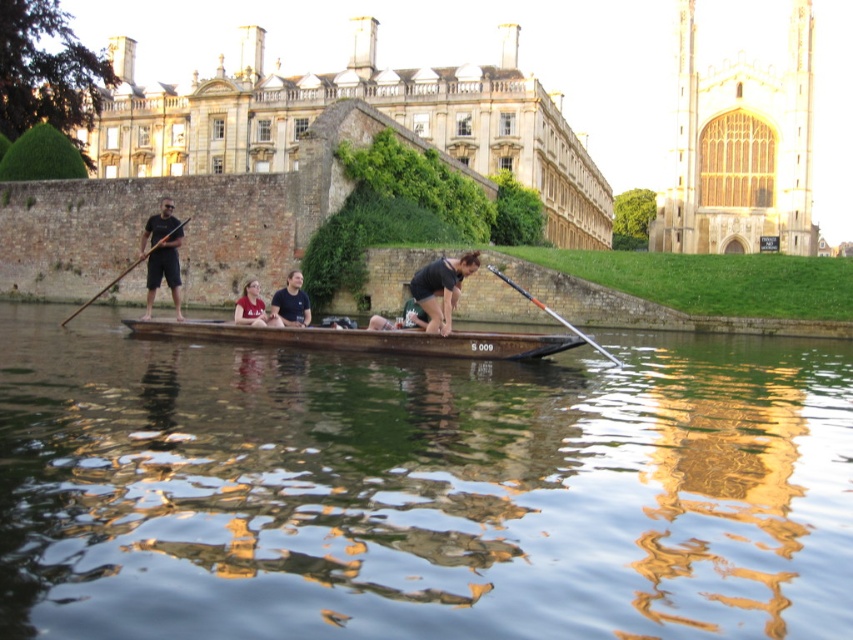
This screenshot has width=853, height=640. What do you see at coordinates (440, 289) in the screenshot?
I see `dark gray fabric shirt at center` at bounding box center [440, 289].

Can you confirm if dark gray fabric shirt at center is wider than wooden paddle at left?

No.

The height and width of the screenshot is (640, 853). Find the location of `dark gray fabric shirt at center`. dark gray fabric shirt at center is located at coordinates (440, 289).

Identify the location of dark gray fabric shirt at center. (440, 289).

Can you confirm if black fabric shirt at center is bigger than wooden paddle at left?

No.

Does black fabric shirt at center have a greater width compared to wooden paddle at left?

No, black fabric shirt at center is not wider than wooden paddle at left.

Identify the location of black fabric shirt at center. This screenshot has width=853, height=640. (291, 301).

You are a GUI agent. You are given a task and a screenshot of the screen. Output one action in this format:
    pyautogui.click(x=<x>, y=<y>)
    Task: Click on the black fabric shirt at center
    This screenshot has width=853, height=640.
    Given the screenshot: What is the action you would take?
    pyautogui.click(x=291, y=301)

Is point (293, 301) positioned in front of point (611, 360)?

No, it is not.

Is black fabric shirt at center taller than orange fiberglass paddle at center?

In fact, black fabric shirt at center may be shorter than orange fiberglass paddle at center.

What are the coordinates of `black fabric shirt at center` in the screenshot? It's located at (291, 301).